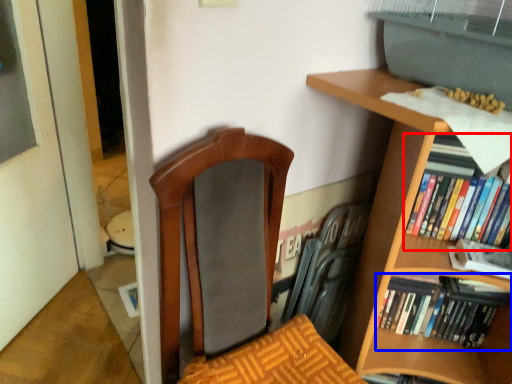
Question: Among these objects, which one is nearest to the camera, book (highlighted by a red box) or book (highlighted by a blue box)?

Choices:
 (A) book
 (B) book

Answer: (A)